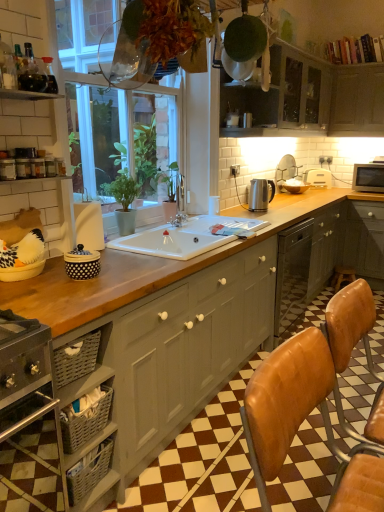
This screenshot has width=384, height=512. What are the coordinates of `blank area to the left of polka dot ceramic jar at left, which is the seventh appliance from back to front` in the screenshot? It's located at (43, 275).